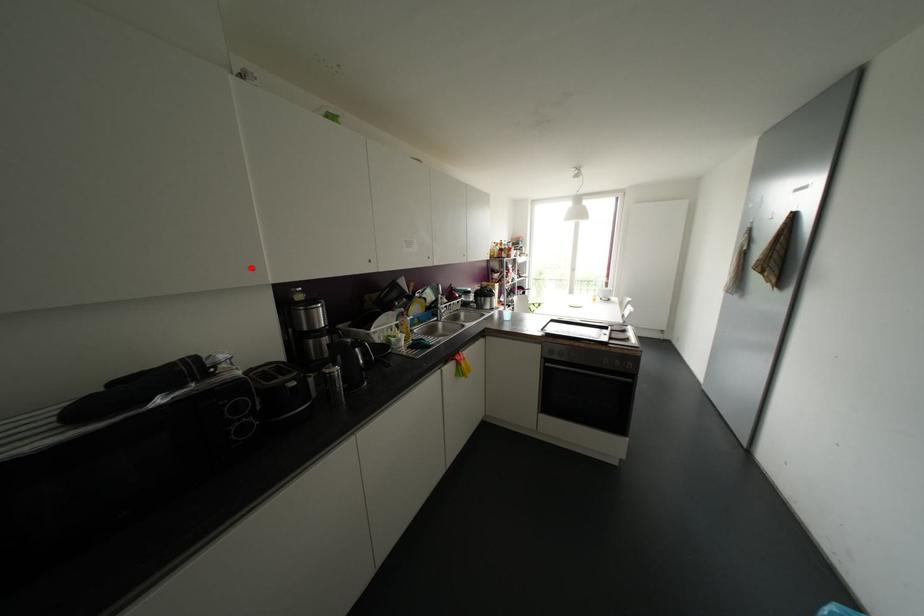
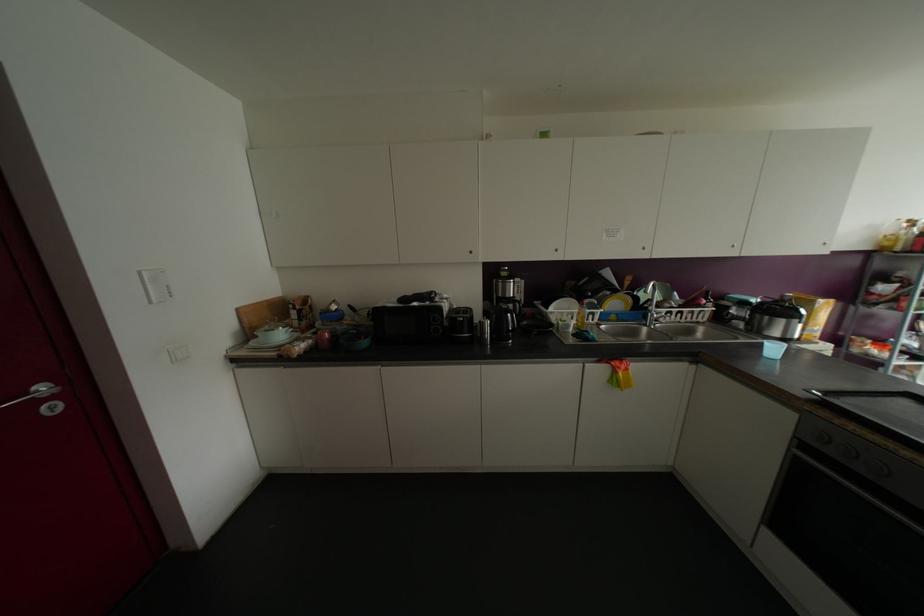
Question: I am providing you with two images of the same scene from different viewpoints. A red point is marked on the first image. At the location where the point appears in image 1, is it still visible in image 2?

Choices:
 (A) Yes
 (B) No

Answer: (A)